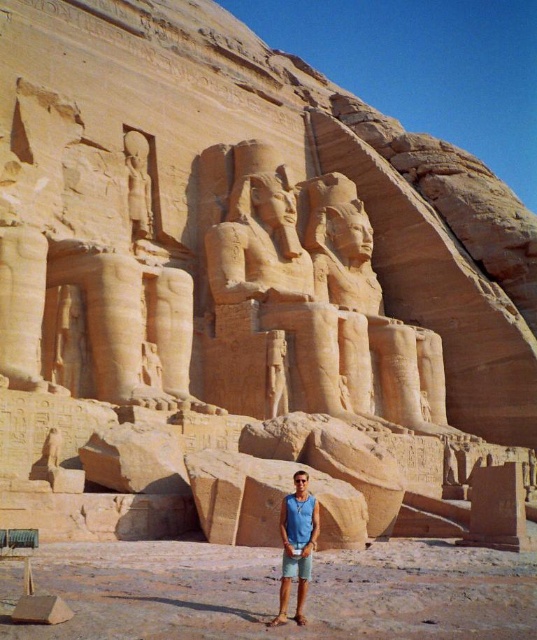
Does blue fabric shirt at center come behind smooth sandstone statue at upper left?

No.

Is blue fabric shirt at center to the right of smooth sandstone statue at upper left from the viewer's perspective?

Indeed, blue fabric shirt at center is positioned on the right side of smooth sandstone statue at upper left.

Between point (279, 609) and point (141, 156), which one is positioned in front?

Point (279, 609) is more forward.

Locate an element on the screen. This screenshot has width=537, height=640. blue fabric shirt at center is located at coordinates (296, 545).